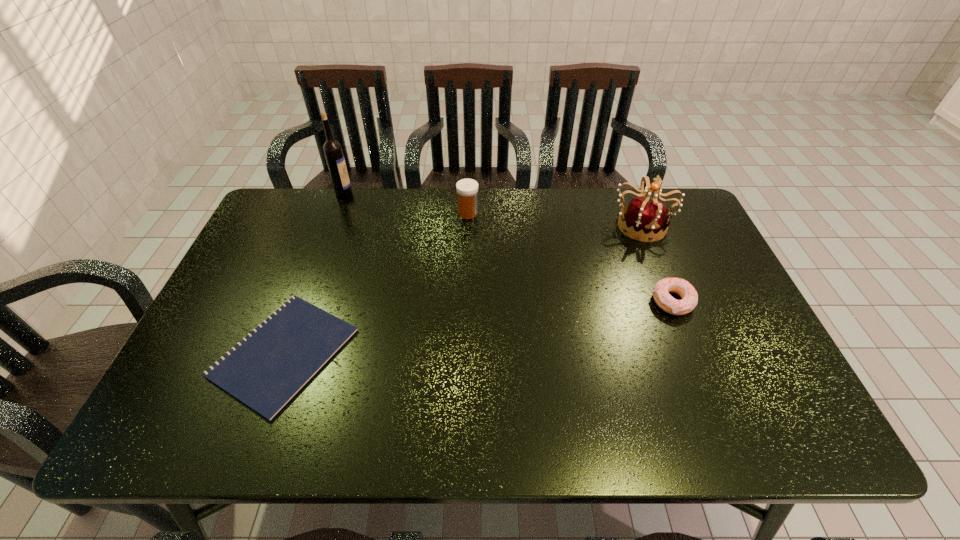
At what (x,y) coordinates should I click in order to perform the action: click on free location that satisfies the following two spatial constraints: 1. on the back side of the doughnut; 2. on the label of the wine bottle. Please return your answer as a coordinate pair (x, y). Looking at the image, I should click on (629, 193).

You are a GUI agent. You are given a task and a screenshot of the screen. Output one action in this format:
    pyautogui.click(x=<x>, y=<y>)
    Task: Click on the free space that satisfies the following two spatial constraints: 1. on the label of the tallest object; 2. on the back side of the doughnut
    The height and width of the screenshot is (540, 960).
    Given the screenshot: What is the action you would take?
    pyautogui.click(x=304, y=302)

Locate an element on the screen. The height and width of the screenshot is (540, 960). free spot that satisfies the following two spatial constraints: 1. on the front-facing side of the fourth shortest object; 2. on the right side of the doughnut is located at coordinates (672, 302).